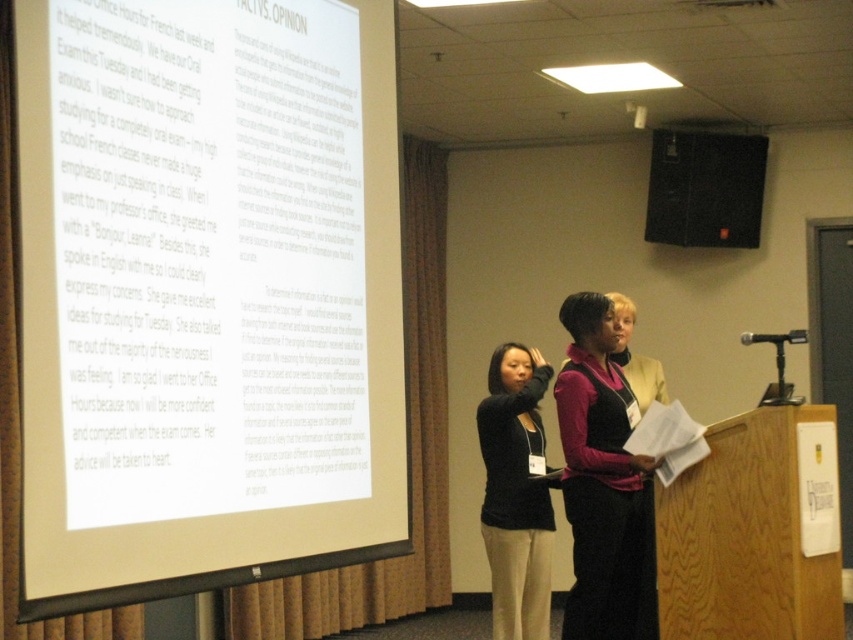
You are standing at the point marked by the coordinates point (379, 214) in the presentation room. You want to move to the exit door located at the back of the room. Is the projection screen between you and the exit door?

The projection screen is between you and the exit door because you are at point (379, 214), which is 3.49 meters away from the viewer, and the exit door is located at the back of the room beyond the screen.